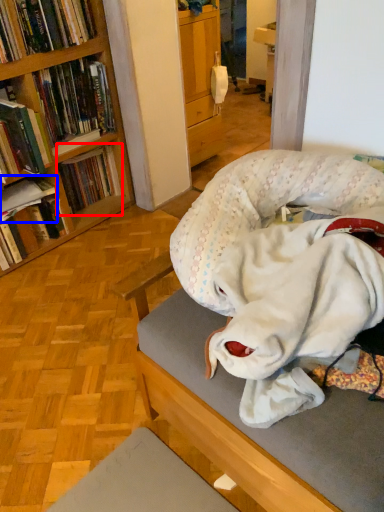
Question: Which point is closer to the camera, book (highlighted by a red box) or book (highlighted by a blue box)?

Choices:
 (A) book
 (B) book

Answer: (B)